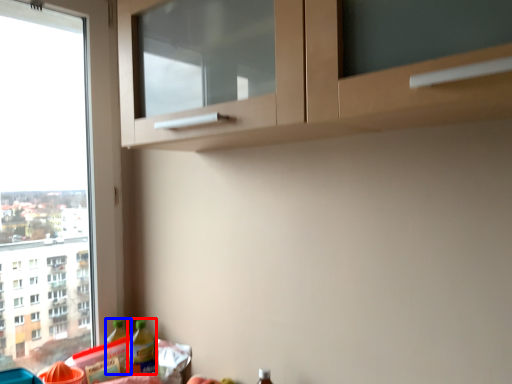
Question: Which object is further to the camera taking this photo, bottle (highlighted by a red box) or bottle (highlighted by a blue box)?

Choices:
 (A) bottle
 (B) bottle

Answer: (B)